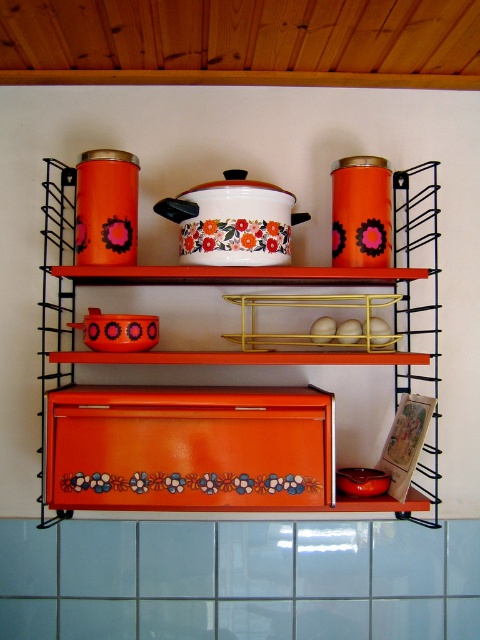
Please provide the coordinates of the orange glossy canister at upper center in the image coordinate system where the origin is at the bottom left corner of the image.

The orange glossy canister at upper center is located at coordinates point (262, 276).

You are a delivery robot trying to place two packages at specific coordinates in the kitchen. The first package must be placed at point (x=424, y=385) and the second at point (x=197, y=216). From your perspective, which point is closer to you?

Point (x=424, y=385) is further to the camera than point (x=197, y=216), so the point (x=197, y=216) is closer to you.

You are organizing a kitchen and need to stack items vertically. You have an orange glossy canister at upper center and a floral enamel pot at center. Which one should you place on top to ensure stability?

The orange glossy canister at upper center is taller than the floral enamel pot at center, so placing the shorter floral enamel pot at center on top would ensure stability.